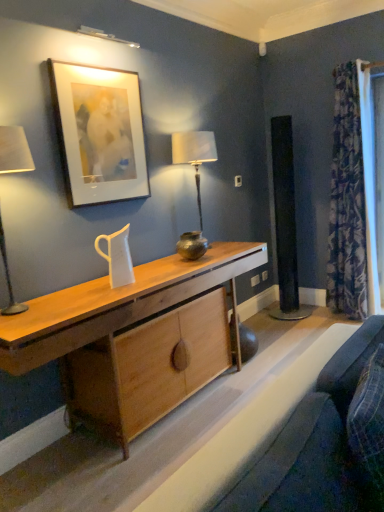
Question: From their relative heights in the image, would you say patterned fabric curtain at right is taller or shorter than velvet blue cushion at lower right, placed as the first swivel chair when sorted from right to left?

Choices:
 (A) tall
 (B) short

Answer: (A)

Question: Looking at their shapes, would you say patterned fabric curtain at right is wider or thinner than velvet blue cushion at lower right, the 2th swivel chair when ordered from left to right?

Choices:
 (A) wide
 (B) thin

Answer: (A)

Question: Based on their relative distances, which object is nearer to the shiny metallic vase at center?

Choices:
 (A) natural wood desk at center
 (B) patterned fabric curtain at right
 (C) velvet blue cushion at lower right, the 2th swivel chair when ordered from left to right
 (D) velvet blue swivel chair at lower right, the 2th swivel chair viewed from the right
 (E) metallic silver table lamp at center

Answer: (A)

Question: Considering the real-world distances, which object is closest to the velvet blue swivel chair at lower right, positioned as the 1th swivel chair in left-to-right order?

Choices:
 (A) matte white picture frame at upper left
 (B) natural wood desk at center
 (C) metallic silver table lamp at center
 (D) shiny metallic vase at center
 (E) patterned fabric curtain at right

Answer: (B)